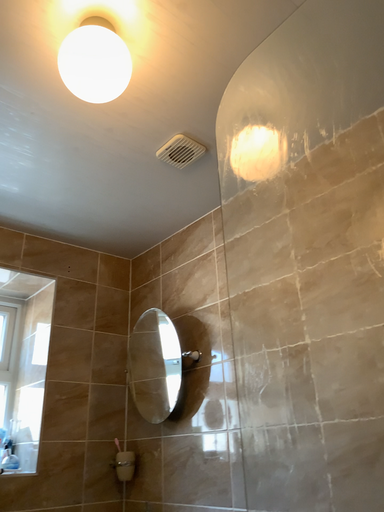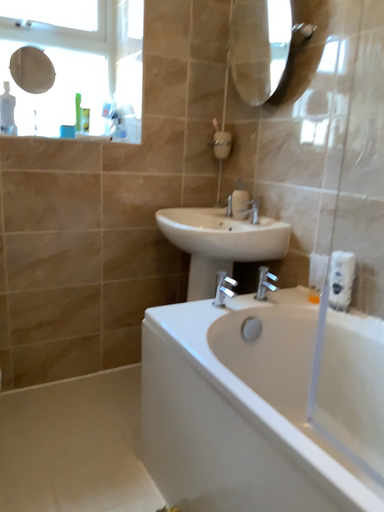
Question: Which way did the camera rotate in the video?

Choices:
 (A) rotated upward
 (B) rotated downward

Answer: (B)